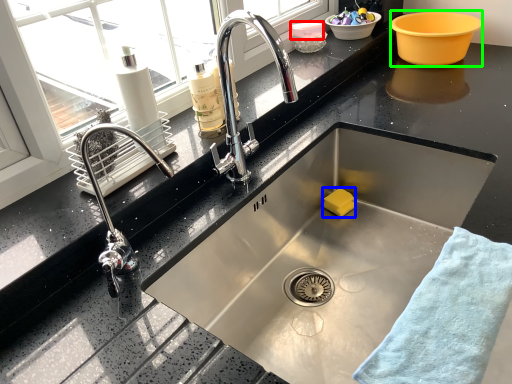
Question: Which object is the closest to the basin (highlighted by a red box)? Choose among these: soap (highlighted by a blue box) or basin (highlighted by a green box).

Choices:
 (A) soap
 (B) basin

Answer: (B)